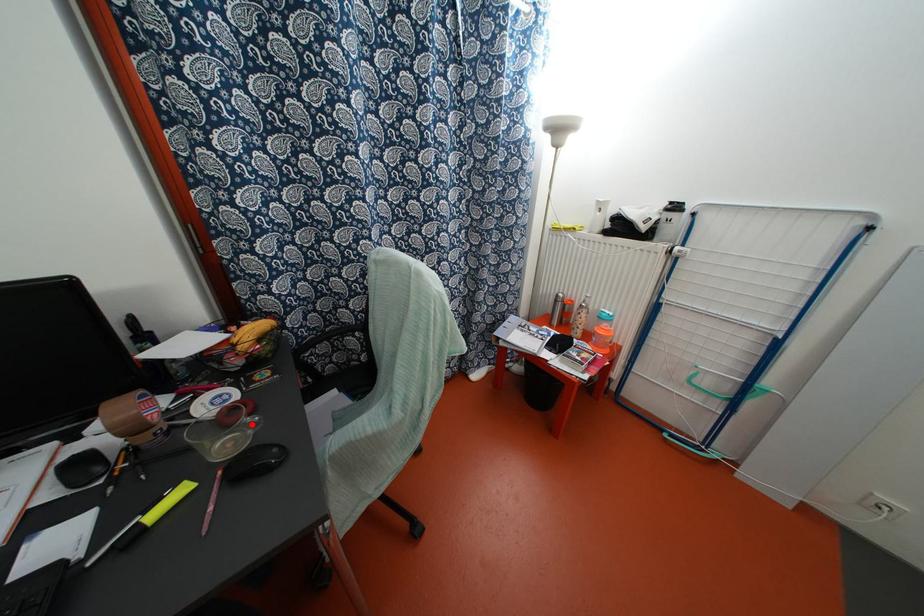
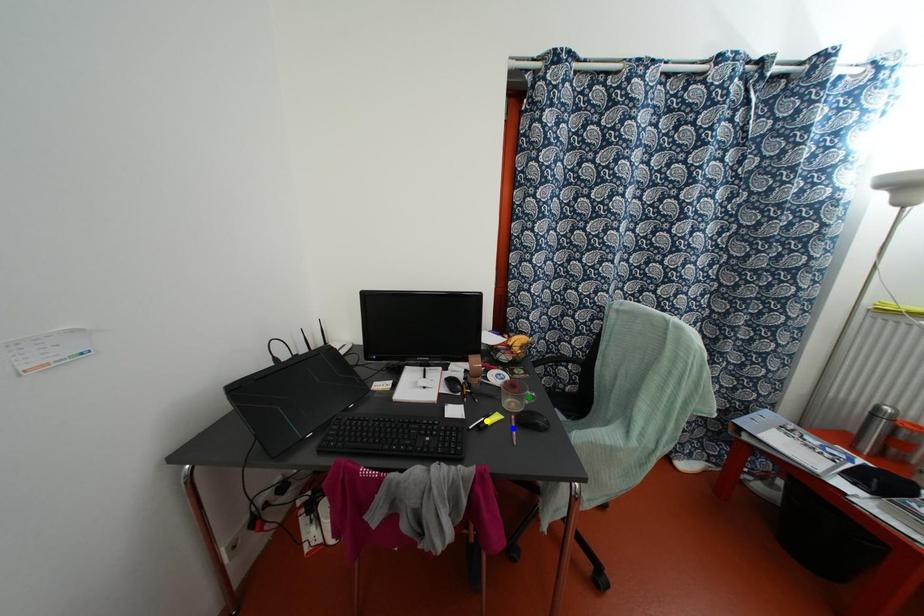
Question: I am providing you with two images of the same scene from different viewpoints. A red point is marked on the first image. You are given multiple points on the second image. Can you choose the point in image 2 that corresponds to the point in image 1?

Choices:
 (A) yellow point
 (B) green point
 (C) blue point

Answer: (B)